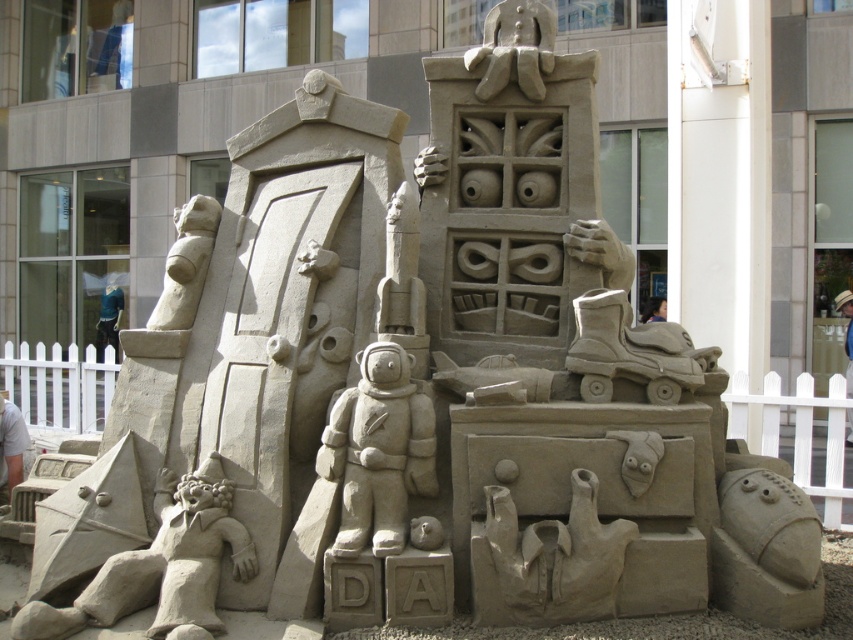
Question: Is the position of smooth sand hands at center less distant than that of smooth sand rocket at lower right?

Choices:
 (A) yes
 (B) no

Answer: (A)

Question: Can you confirm if smooth beige astronaut at center is bigger than smooth skin face at upper right?

Choices:
 (A) yes
 (B) no

Answer: (A)

Question: Which point appears closest to the camera in this image?

Choices:
 (A) (843, 305)
 (B) (659, 298)
 (C) (178, 314)
 (D) (611, 584)

Answer: (D)

Question: Estimate the real-world distances between objects in this image. Which object is closer to the blue fabric shirt at center?

Choices:
 (A) smooth skin face at upper right
 (B) smooth sand rocket at lower right
 (C) smooth beige astronaut at center

Answer: (A)

Question: Which object appears farthest from the camera in this image?

Choices:
 (A) smooth sand hands at center
 (B) smooth white person at center
 (C) smooth skin face at upper right
 (D) blue fabric shirt at center

Answer: (D)

Question: Can you confirm if smooth sand rocket at lower right is smaller than smooth white person at center?

Choices:
 (A) no
 (B) yes

Answer: (A)